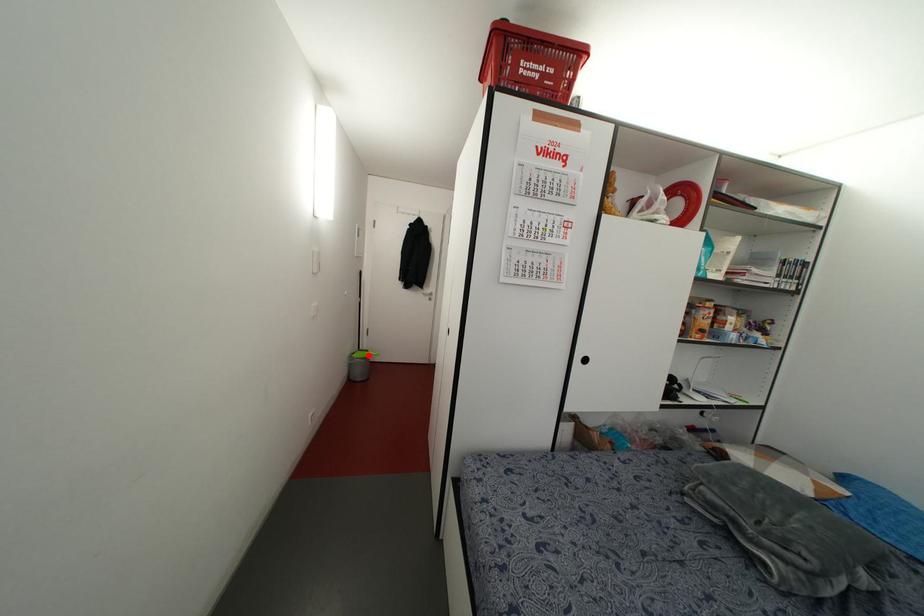
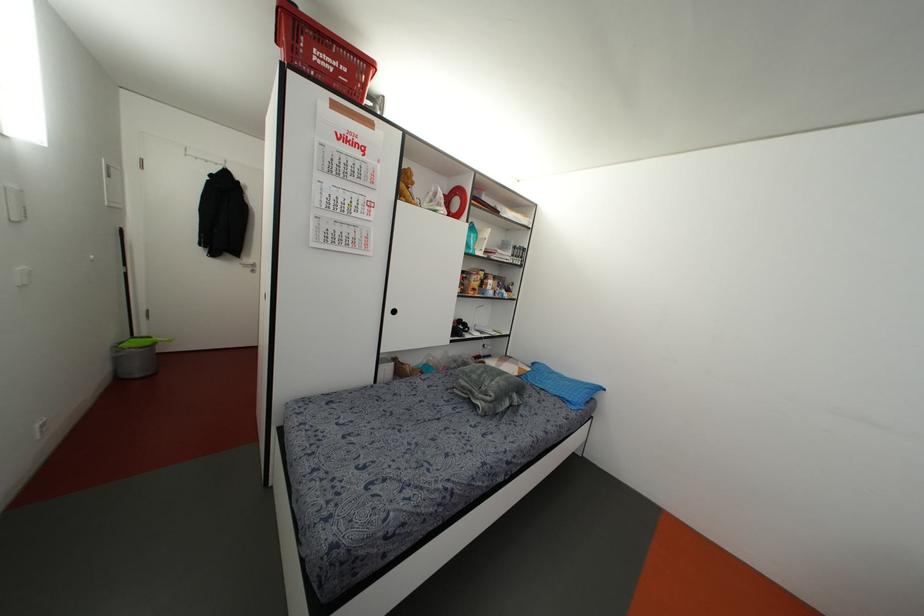
Find the pixel in the second image that matches the highlighted location in the first image.

(153, 342)